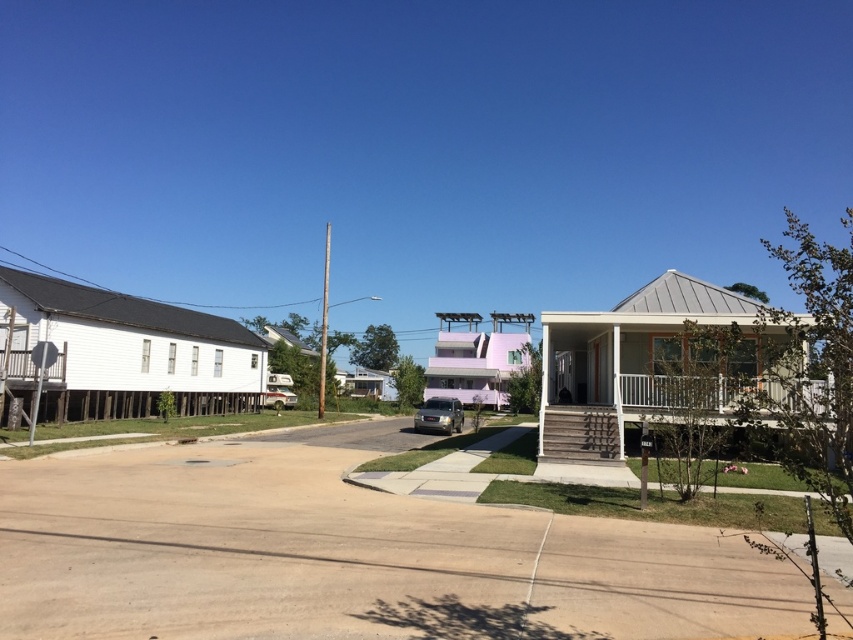
You are a delivery person trying to park your metallic silver car at center in the residential area. There is a smooth concrete driveway at center nearby. Can you park your car on the driveway?

The smooth concrete driveway at center is to the right of the metallic silver car at center. Since the driveway is positioned to the right of the car, it is possible to maneuver the car onto the driveway for parking.